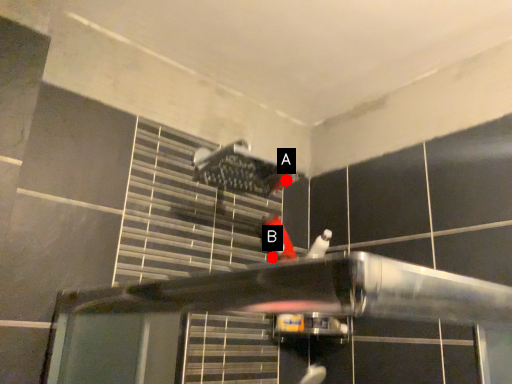
Question: Two points are circled on the image, labeled by A and B beside each circle. Which of the following is the closest to the observer?

Choices:
 (A) A is closer
 (B) B is closer

Answer: (A)